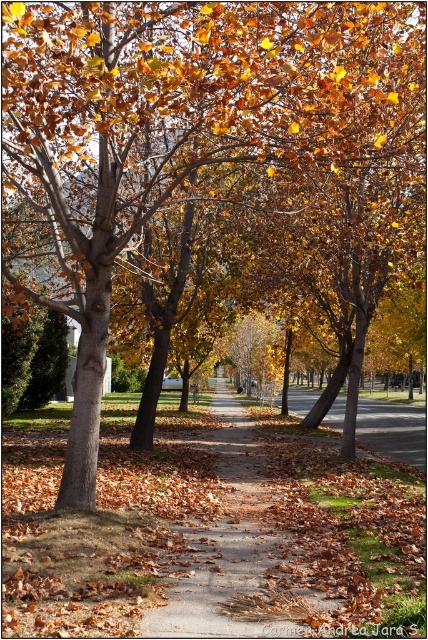
Question: Which point is farther from the camera taking this photo?

Choices:
 (A) (178, 634)
 (B) (391, 426)

Answer: (B)

Question: Does brown dirt path at center appear under brown asphalt at center?

Choices:
 (A) yes
 (B) no

Answer: (B)

Question: Can you confirm if brown dirt path at center is thinner than brown asphalt at center?

Choices:
 (A) no
 (B) yes

Answer: (B)

Question: Does brown dirt path at center appear over brown asphalt at center?

Choices:
 (A) no
 (B) yes

Answer: (B)